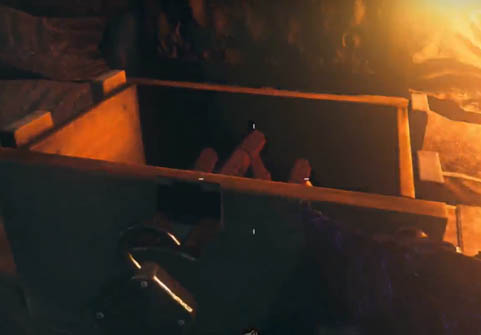
You are a GUI agent. You are given a task and a screenshot of the screen. Output one action in this format:
    pyautogui.click(x=<x>, y=<y>)
    Task: Click on the nail hole or nail head
    
    Given the screenshot: What is the action you would take?
    pyautogui.click(x=123, y=108), pyautogui.click(x=57, y=150)